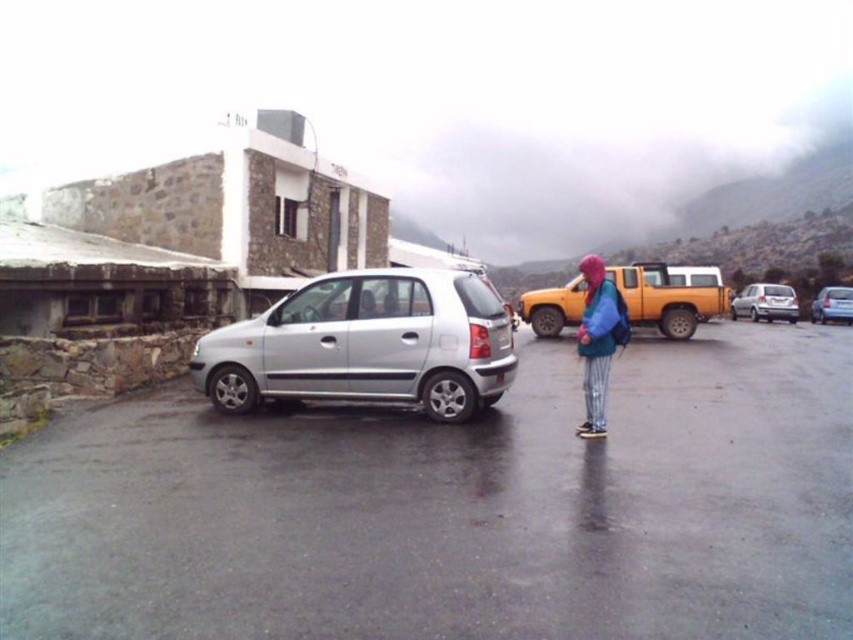
Question: Which object appears closest to the camera in this image?

Choices:
 (A) metallic blue sedan at right
 (B) orange matte truck at right

Answer: (B)

Question: Is silver metallic car at center-left wider than silver metallic minivan at center-left?

Choices:
 (A) no
 (B) yes

Answer: (B)

Question: Which object is the closest to the silver metallic minivan at center-left?

Choices:
 (A) metallic blue sedan at right
 (B) silver metallic car at center-left

Answer: (B)

Question: Is orange matte truck at right to the left of metallic blue sedan at right from the viewer's perspective?

Choices:
 (A) yes
 (B) no

Answer: (A)

Question: Does silver metallic minivan at center-left have a lesser width compared to silver metallic hatchback at center-right?

Choices:
 (A) no
 (B) yes

Answer: (B)

Question: Which object is positioned farthest from the orange matte truck at right?

Choices:
 (A) silver metallic hatchback at center-right
 (B) silver metallic minivan at center-left
 (C) metallic blue sedan at right

Answer: (C)